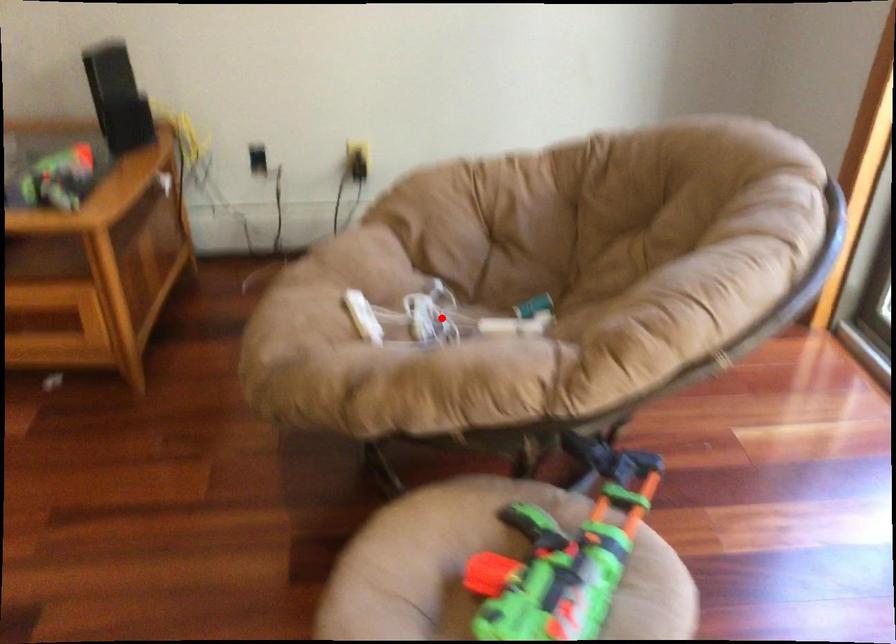
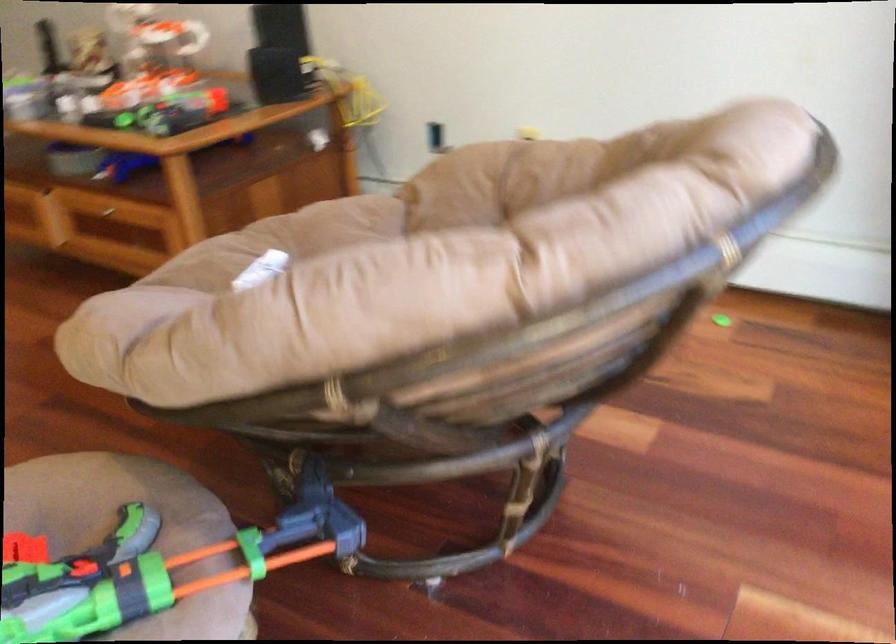
Question: I am providing you with two images of the same scene from different viewpoints. A red point is marked on the first image. At the location where the point appears in image 1, is it still visible in image 2?

Choices:
 (A) Yes
 (B) No

Answer: (B)